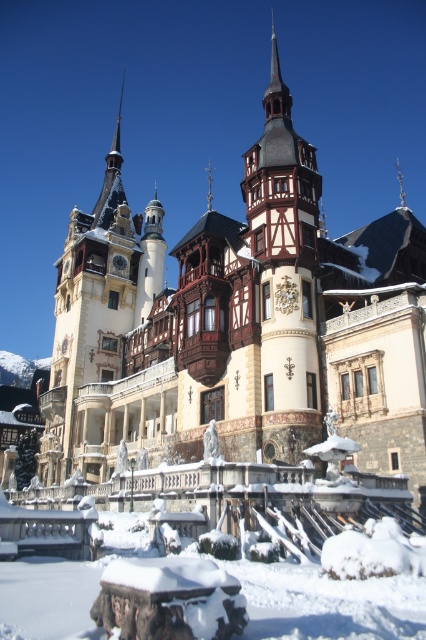
What do you see at coordinates (97, 321) in the screenshot? The width and height of the screenshot is (426, 640). I see `white painted wood tower at left` at bounding box center [97, 321].

Which is more to the right, white painted wood tower at left or wooden tower at center?

wooden tower at center

The width and height of the screenshot is (426, 640). What do you see at coordinates (97, 321) in the screenshot?
I see `white painted wood tower at left` at bounding box center [97, 321].

Locate an element on the screen. white painted wood tower at left is located at coordinates coord(97,321).